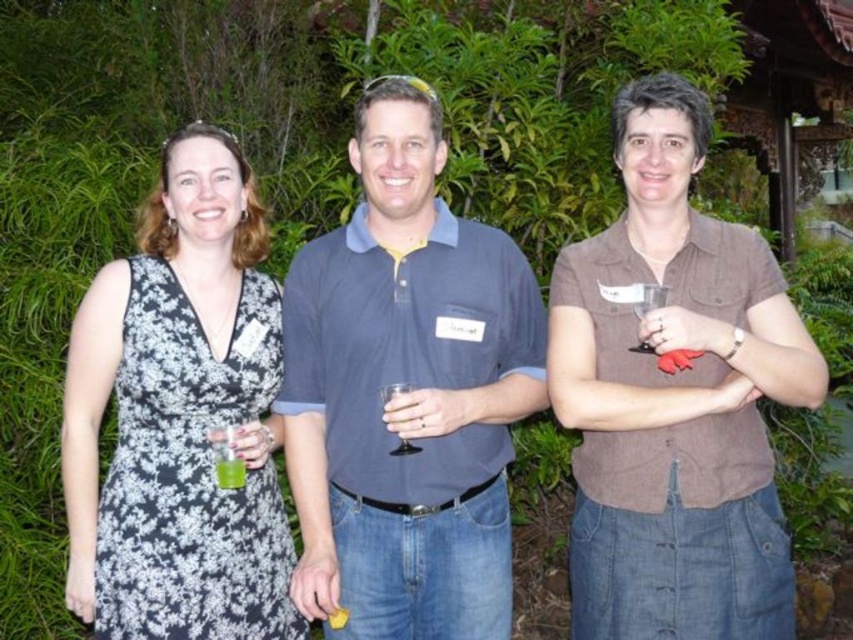
Does point (595, 611) come behind point (213, 189)?

No, it is not.

Does brown cotton shirt at right have a larger size compared to black floral dress at left?

No, brown cotton shirt at right is not bigger than black floral dress at left.

Where is `brown cotton shirt at right`? The height and width of the screenshot is (640, 853). brown cotton shirt at right is located at coordinates (675, 397).

Does blue cotton polo shirt at center appear on the right side of black floral dress at left?

Yes, blue cotton polo shirt at center is to the right of black floral dress at left.

Can you confirm if blue cotton polo shirt at center is smaller than black floral dress at left?

Actually, blue cotton polo shirt at center might be larger than black floral dress at left.

Between point (485, 576) and point (88, 572), which one is positioned in front?

Point (88, 572) is in front.

Locate an element on the screen. The image size is (853, 640). blue cotton polo shirt at center is located at coordinates (405, 392).

Is blue cotton polo shirt at center bigger than brown cotton shirt at right?

Yes.

Does blue cotton polo shirt at center have a greater height compared to brown cotton shirt at right?

Incorrect, blue cotton polo shirt at center's height is not larger of brown cotton shirt at right's.

You are a GUI agent. You are given a task and a screenshot of the screen. Output one action in this format:
    pyautogui.click(x=<x>, y=<y>)
    Task: Click on the blue cotton polo shirt at center
    This screenshot has height=640, width=853.
    Given the screenshot: What is the action you would take?
    pyautogui.click(x=405, y=392)